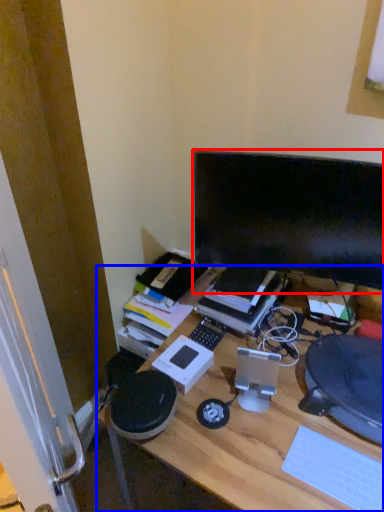
Question: Which of the following is the farthest to the observer, computer monitor (highlighted by a red box) or desk (highlighted by a blue box)?

Choices:
 (A) computer monitor
 (B) desk

Answer: (A)